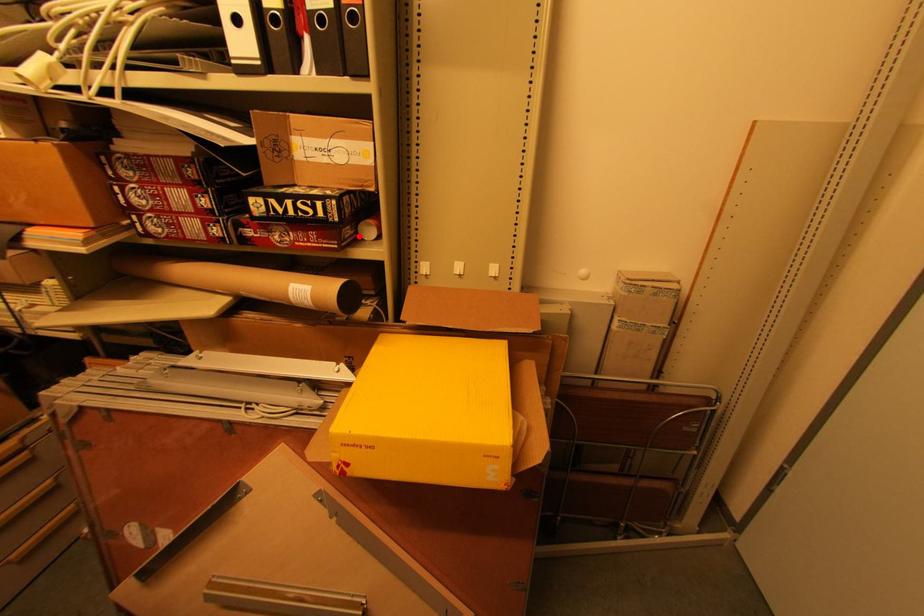
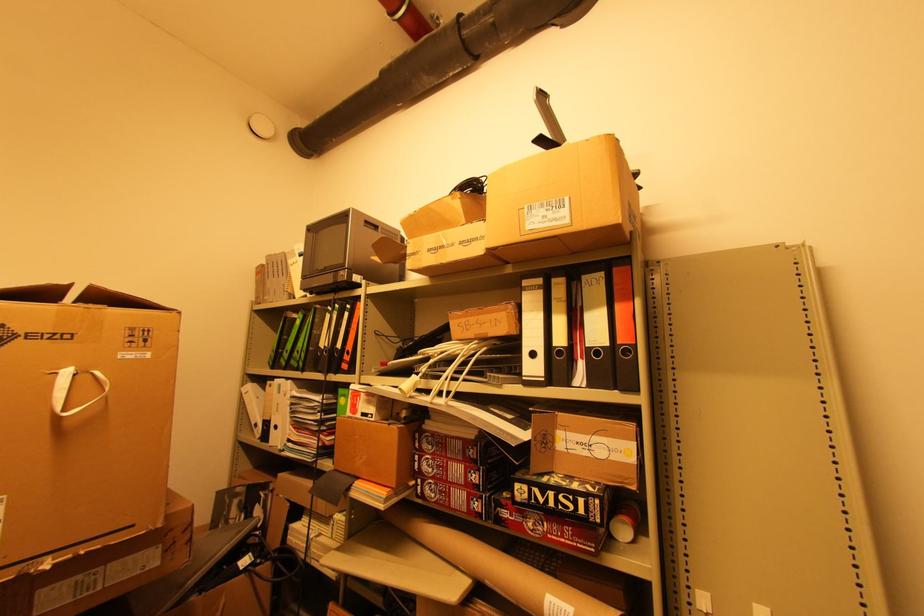
Question: I am providing you with two images of the same scene from different viewpoints. A red point is marked on the first image. Can you still see the location of the red point in image 2?

Choices:
 (A) Yes
 (B) No

Answer: (A)